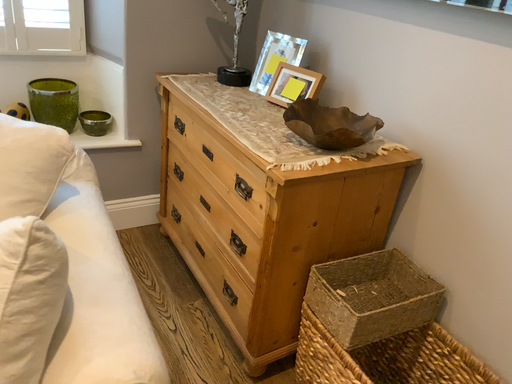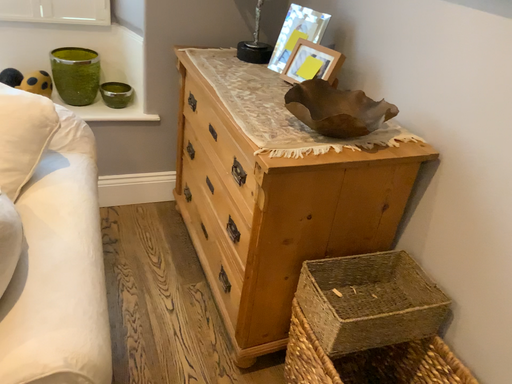
Question: How did the camera likely rotate when shooting the video?

Choices:
 (A) rotated right
 (B) rotated left

Answer: (B)